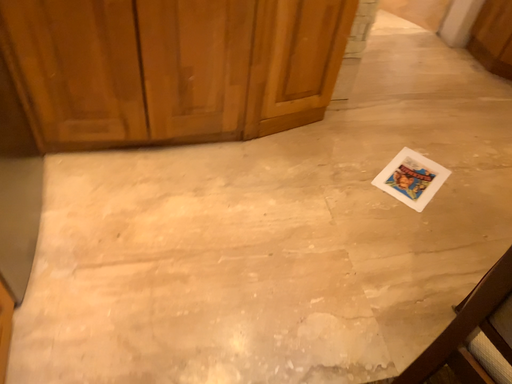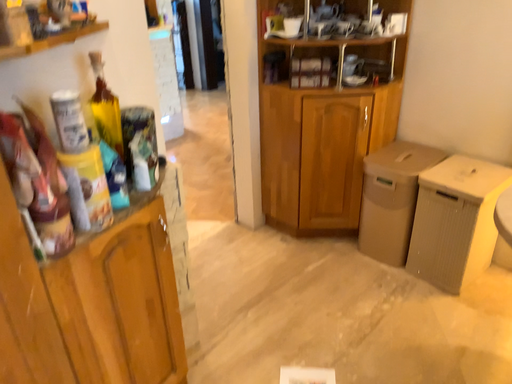
Question: How did the camera likely rotate when shooting the video?

Choices:
 (A) rotated downward
 (B) rotated upward

Answer: (B)